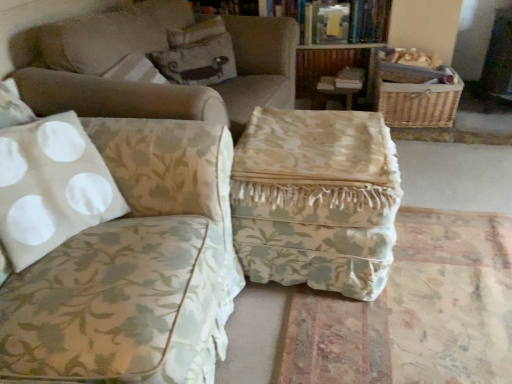
Question: Considering the positions of hardcover book at upper center and floral fabric ottoman at center in the image, is hardcover book at upper center taller or shorter than floral fabric ottoman at center?

Choices:
 (A) tall
 (B) short

Answer: (B)

Question: Is hardcover book at upper center situated inside floral fabric ottoman at center or outside?

Choices:
 (A) inside
 (B) outside

Answer: (B)

Question: Which object is the farthest from the floral fabric ottoman at center?

Choices:
 (A) floral fabric ottoman at center
 (B) floral fabric ottoman at center, which is the first studio couch from back to front
 (C) floral fabric pillow at upper center
 (D) woven brown basket at upper right
 (E) white fabric studio couch at left, which appears as the 1th studio couch when viewed from the front

Answer: (C)

Question: Estimate the real-world distances between objects in this image. Which object is farther from the white fabric studio couch at left, which appears as the 1th studio couch when viewed from the front?

Choices:
 (A) floral fabric ottoman at center, which is counted as the second studio couch, starting from the front
 (B) floral fabric ottoman at center
 (C) woven brown basket at upper right
 (D) floral fabric ottoman at center
 (E) hardcover book at upper center

Answer: (E)